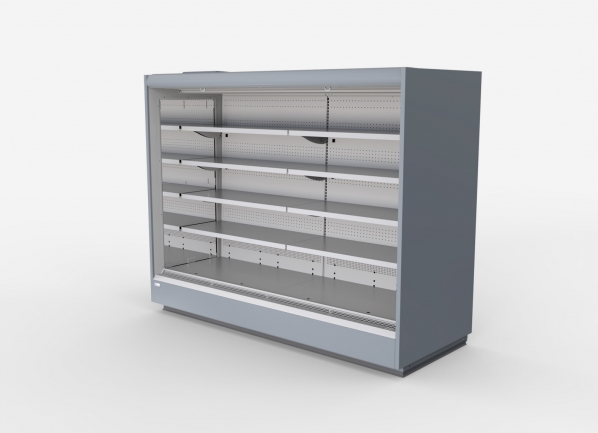
Identify the location of fourth shelf. This screenshot has width=598, height=433. (274, 171).